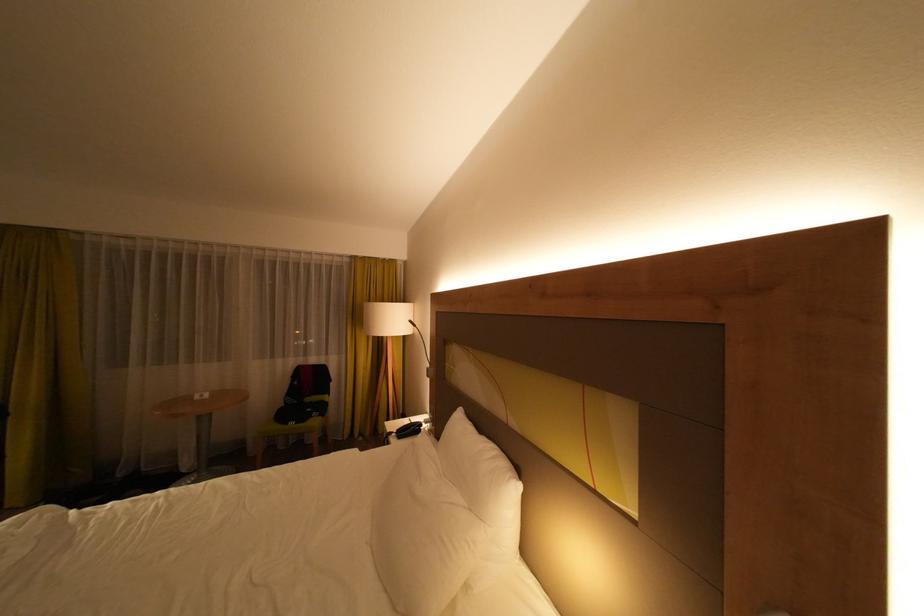
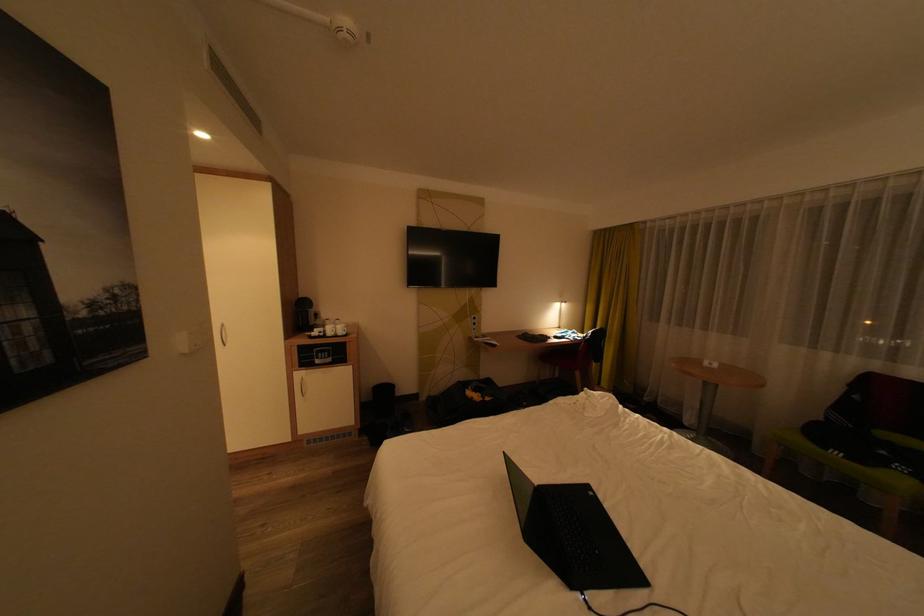
Question: The camera is either moving clockwise (left) or counter-clockwise (right) around the object. The first image is from the beginning of the video and the second image is from the end. Is the camera moving left or right when shooting the video?

Choices:
 (A) Left
 (B) Right

Answer: (B)